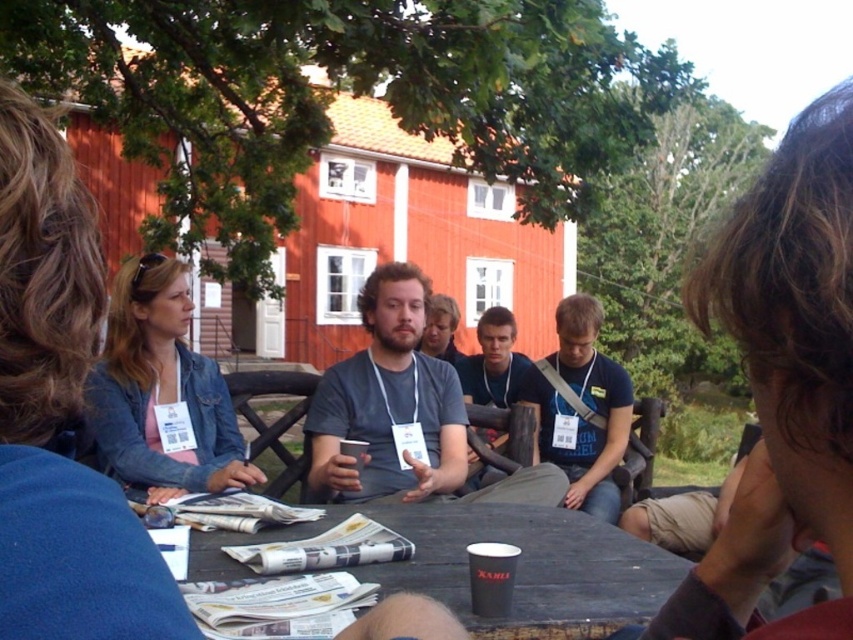
Question: Which of the following is the closest to the observer?

Choices:
 (A) (503, 440)
 (B) (573, 413)
 (C) (459, 570)

Answer: (C)

Question: Which of the following is the farthest from the observer?

Choices:
 (A) (584, 448)
 (B) (387, 368)
 (C) (500, 330)
 (D) (666, 580)

Answer: (C)

Question: Is wooden picnic table at center smaller than matte gray shirt at center?

Choices:
 (A) yes
 (B) no

Answer: (A)

Question: Among these objects, which one is nearest to the camera?

Choices:
 (A) matte gray t-shirt at center
 (B) blue fabric shirt at center

Answer: (A)

Question: Can you confirm if matte gray t-shirt at center is bigger than matte gray shirt at center?

Choices:
 (A) no
 (B) yes

Answer: (B)

Question: Is matte gray t-shirt at center above blue fabric shirt at center?

Choices:
 (A) no
 (B) yes

Answer: (B)